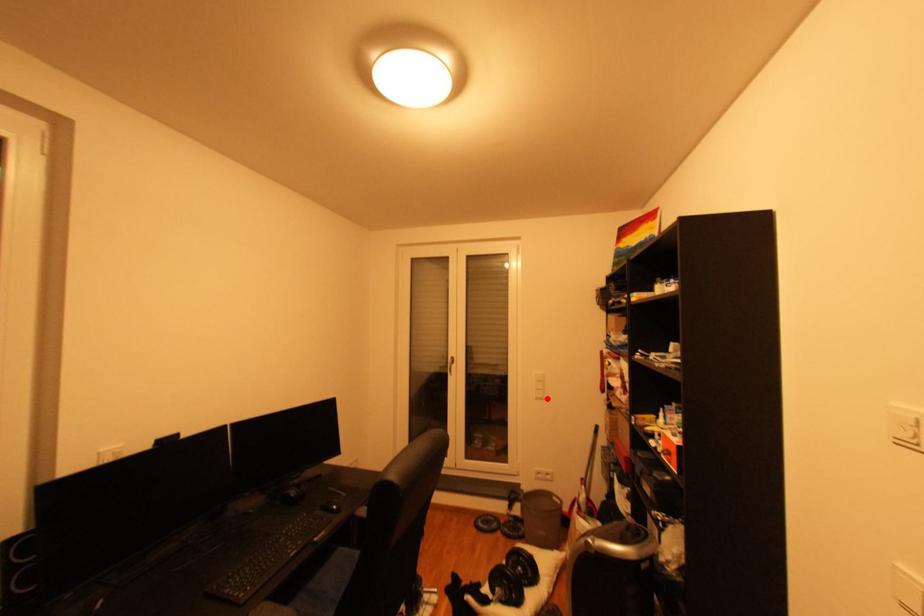
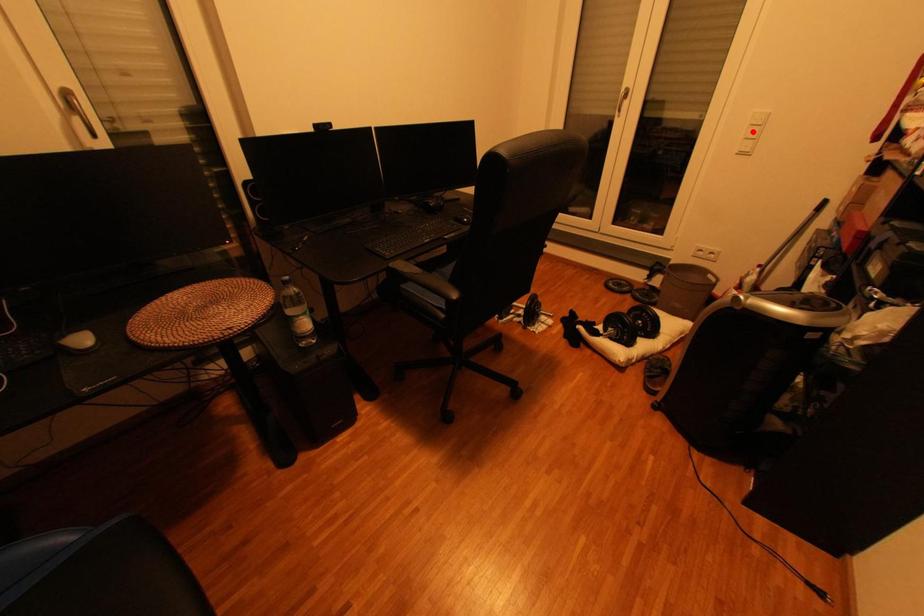
I am providing you with two images of the same scene from different viewpoints. A red point is marked on the first image and another point is marked on the second image. Are the points marked in image1 and image2 representing the same 3D position?

No